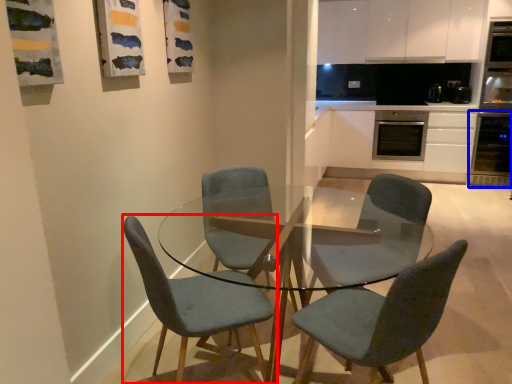
Question: Which of the following is the closest to the observer, chair (highlighted by a red box) or oven (highlighted by a blue box)?

Choices:
 (A) chair
 (B) oven

Answer: (A)